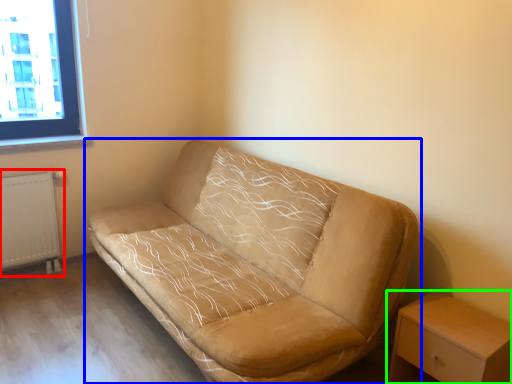
Question: Estimate the real-world distances between objects in this image. Which object is closer to radiator (highlighted by a red box), studio couch (highlighted by a blue box) or nightstand (highlighted by a green box)?

Choices:
 (A) studio couch
 (B) nightstand

Answer: (A)